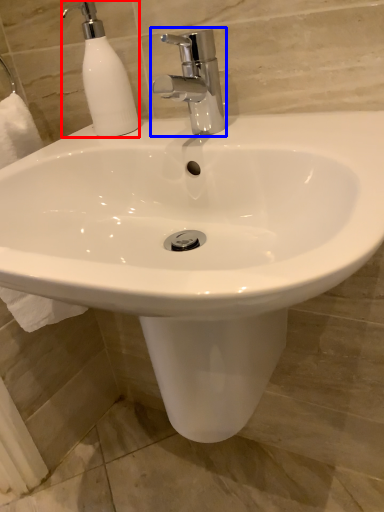
Question: Among these objects, which one is farthest to the camera, soap dispenser (highlighted by a red box) or tap (highlighted by a blue box)?

Choices:
 (A) soap dispenser
 (B) tap

Answer: (A)